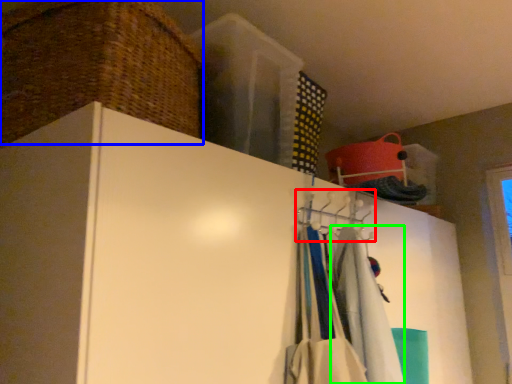
Question: Which is nearer to the hanger (highlighted by a red box)? basket (highlighted by a blue box) or clothing (highlighted by a green box).

Choices:
 (A) basket
 (B) clothing

Answer: (B)